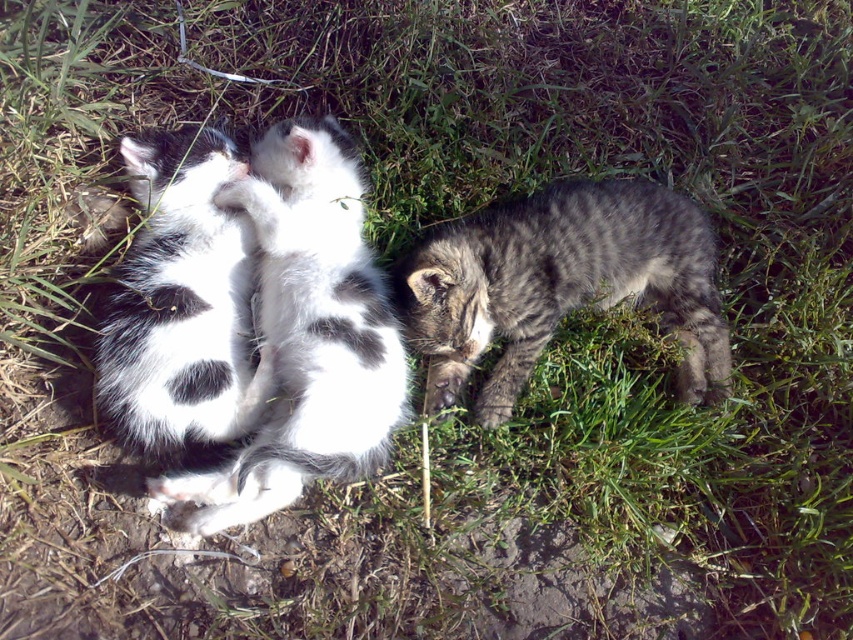
Can you confirm if black and white fur kitten at center is positioned below gray striped kitten at center?

Correct, black and white fur kitten at center is located below gray striped kitten at center.

Is point (283, 276) positioned behind point (534, 269)?

No.

This screenshot has height=640, width=853. What do you see at coordinates (306, 332) in the screenshot?
I see `black and white fur kitten at center` at bounding box center [306, 332].

The width and height of the screenshot is (853, 640). I want to click on black and white fur kitten at center, so click(306, 332).

Who is lower down, black and white fur kitten at center or white soft fur kitten at center?

black and white fur kitten at center is below.

Is black and white fur kitten at center to the right of white soft fur kitten at center from the viewer's perspective?

Yes, black and white fur kitten at center is to the right of white soft fur kitten at center.

The width and height of the screenshot is (853, 640). What do you see at coordinates (306, 332) in the screenshot?
I see `black and white fur kitten at center` at bounding box center [306, 332].

Locate an element on the screen. The height and width of the screenshot is (640, 853). black and white fur kitten at center is located at coordinates (306, 332).

Is gray striped kitten at center shorter than white soft fur kitten at center?

Correct, gray striped kitten at center is not as tall as white soft fur kitten at center.

Looking at this image, does gray striped kitten at center appear over white soft fur kitten at center?

No.

Describe the element at coordinates (560, 284) in the screenshot. This screenshot has height=640, width=853. I see `gray striped kitten at center` at that location.

Locate an element on the screen. gray striped kitten at center is located at coordinates (560, 284).